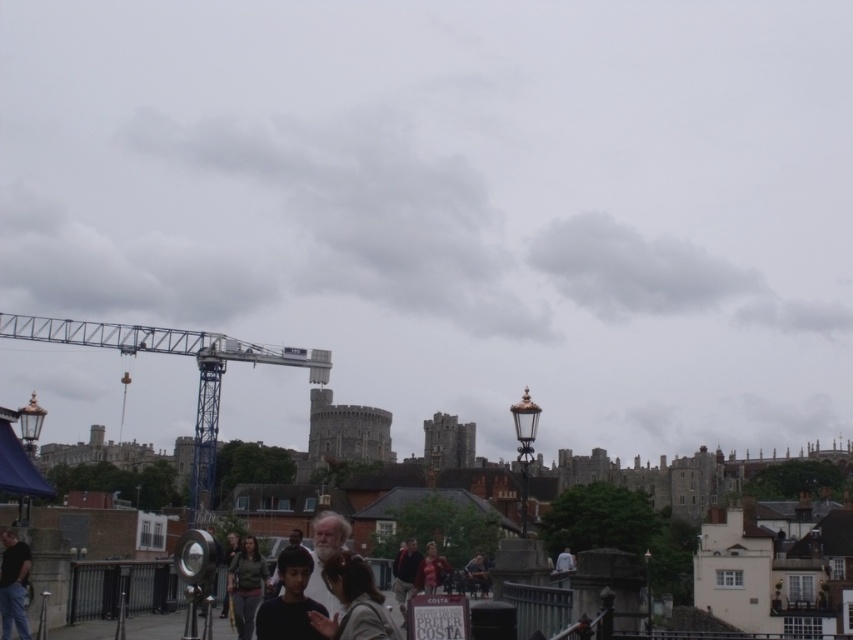
You are a photographer trying to capture both the smooth black shirt at center and the matte red dress at center in a single frame. Given their sizes, which one should you focus on to ensure both are clearly visible in your photo?

Since the smooth black shirt at center is larger in size than the matte red dress at center, you should focus on the smooth black shirt at center to ensure both are clearly visible in the photo.

You are a tourist visiting the historic town and notice both the metallic amusement park ride at center and the matte red dress at center in the scene. Which object is larger?

The metallic amusement park ride at center is bigger than the matte red dress at center.

You are standing in the historic town scene with a metallic amusement park ride at center and a dark gray shirt at lower left. Which object is nearer to you?

The metallic amusement park ride at center is closer to the viewer than the dark gray shirt at lower left.